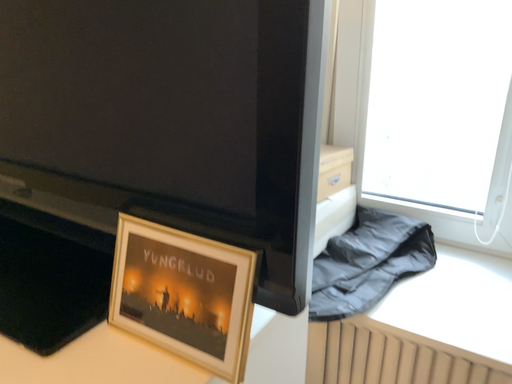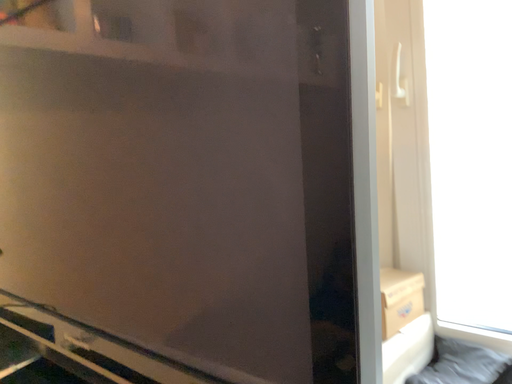
Question: How did the camera likely rotate when shooting the video?

Choices:
 (A) rotated upward
 (B) rotated downward

Answer: (A)